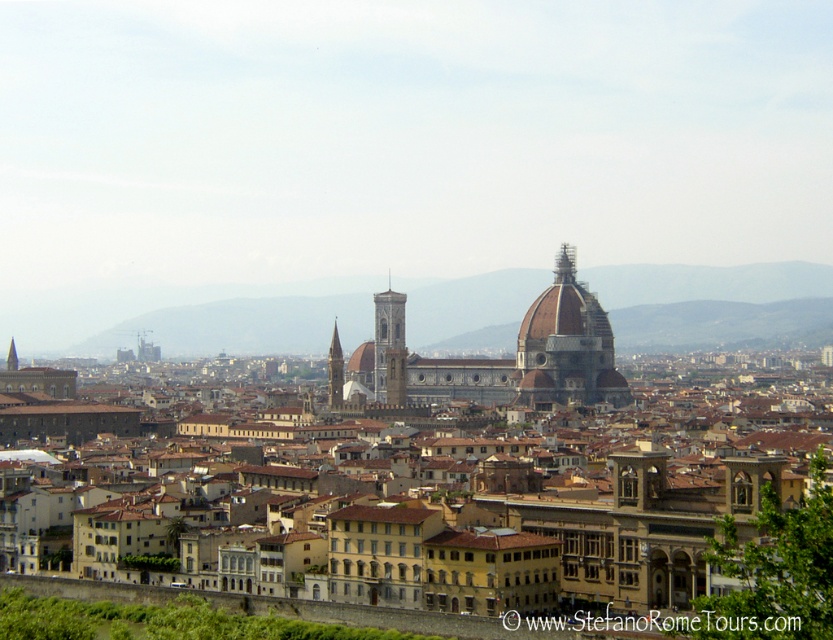
Question: Which object appears farthest from the camera in this image?

Choices:
 (A) smooth stone tower at center
 (B) matte gray dome at center

Answer: (B)

Question: Which of these objects is positioned farthest from the smooth stone tower at center?

Choices:
 (A) smooth stone bell tower at center
 (B) matte gray dome at center

Answer: (B)

Question: Is smooth stone bell tower at center further to camera compared to smooth stone tower at center?

Choices:
 (A) no
 (B) yes

Answer: (B)

Question: Is matte gray dome at center smaller than smooth stone tower at center?

Choices:
 (A) no
 (B) yes

Answer: (A)

Question: From the image, what is the correct spatial relationship of matte gray dome at center in relation to smooth stone bell tower at center?

Choices:
 (A) left
 (B) right

Answer: (B)

Question: Which of the following is the farthest from the observer?

Choices:
 (A) (333, 394)
 (B) (547, 296)

Answer: (B)